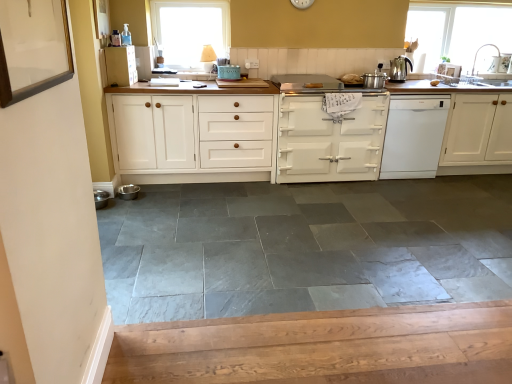
Question: Considering the relative sizes of gray slate tile at center and white matte cabinet at right, the 4th cabinetry viewed from the left, in the image provided, is gray slate tile at center bigger than white matte cabinet at right, the 4th cabinetry viewed from the left,?

Choices:
 (A) yes
 (B) no

Answer: (B)

Question: Does gray slate tile at center have a lesser height compared to white matte cabinet at right, which is counted as the 1th cabinetry, starting from the right?

Choices:
 (A) no
 (B) yes

Answer: (B)

Question: Is gray slate tile at center far away from white matte cabinet at right, which is counted as the 1th cabinetry, starting from the right?

Choices:
 (A) yes
 (B) no

Answer: (A)

Question: From a real-world perspective, is gray slate tile at center on top of white matte cabinet at right, the 4th cabinetry viewed from the left?

Choices:
 (A) no
 (B) yes

Answer: (A)

Question: Does gray slate tile at center appear on the left side of white matte cabinet at right, which is counted as the 1th cabinetry, starting from the right?

Choices:
 (A) no
 (B) yes

Answer: (B)

Question: Considering the relative sizes of gray slate tile at center and white matte cabinet at right, which is counted as the 1th cabinetry, starting from the right, in the image provided, is gray slate tile at center smaller than white matte cabinet at right, which is counted as the 1th cabinetry, starting from the right,?

Choices:
 (A) no
 (B) yes

Answer: (B)

Question: Are matte green enamel stove at center, the third appliance viewed from the top, and transparent glass window at upper right, the 2th window in the left-to-right sequence, making contact?

Choices:
 (A) yes
 (B) no

Answer: (B)

Question: Is matte green enamel stove at center, the 3th appliance positioned from the bottom, thinner than transparent glass window at upper right, the 1th window when ordered from right to left?

Choices:
 (A) yes
 (B) no

Answer: (B)

Question: From the image's perspective, is matte green enamel stove at center, marked as the 2th appliance in a left-to-right arrangement, located beneath transparent glass window at upper right, the first window positioned from the back?

Choices:
 (A) no
 (B) yes

Answer: (B)

Question: Is matte green enamel stove at center, which ranks as the 3th appliance in front-to-back order, shorter than transparent glass window at upper right, the 2th window in the left-to-right sequence?

Choices:
 (A) no
 (B) yes

Answer: (B)

Question: Can you confirm if matte green enamel stove at center, the 3th appliance positioned from the bottom, is smaller than transparent glass window at upper right, the 2th window in the left-to-right sequence?

Choices:
 (A) no
 (B) yes

Answer: (B)

Question: Is matte green enamel stove at center, the third appliance viewed from the back, far from transparent glass window at upper right, the 2th window in the left-to-right sequence?

Choices:
 (A) no
 (B) yes

Answer: (B)

Question: Does metallic silver sink at right, which is the 5th appliance in bottom-to-top order, appear on the right side of white glossy dishwasher at right?

Choices:
 (A) yes
 (B) no

Answer: (A)